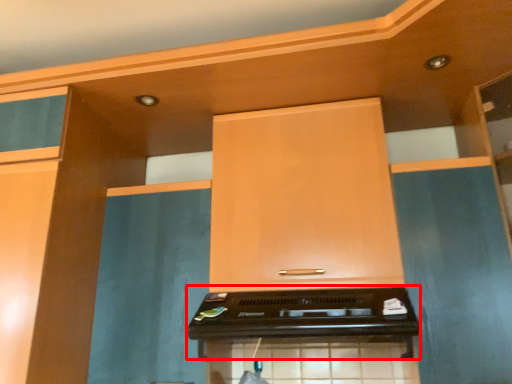
Question: From the image's perspective, where is appliance (annotated by the red box) located relative to cabinetry?

Choices:
 (A) below
 (B) above

Answer: (A)